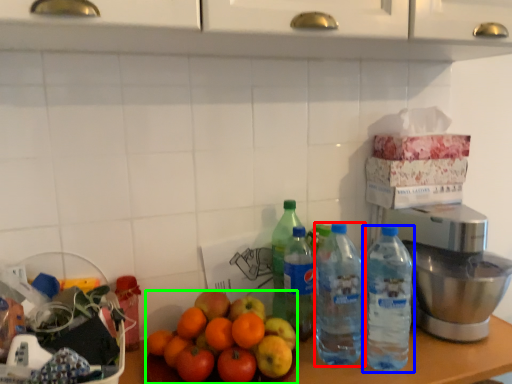
Question: Estimate the real-world distances between objects in this image. Which object is closer to bottle (highlighted by a red box), bottle (highlighted by a blue box) or orange (highlighted by a green box)?

Choices:
 (A) bottle
 (B) orange

Answer: (A)